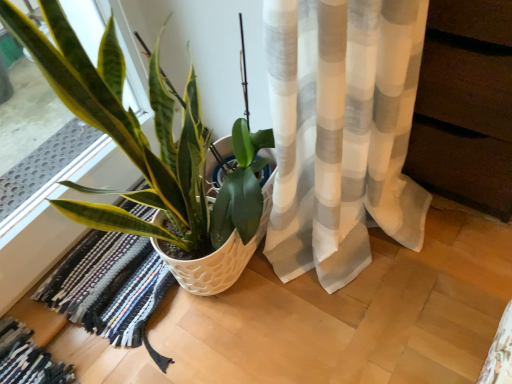
What is the approximate height of white textured pot at lower left?

29.17 inches.

At what (x,y) coordinates should I click in order to perform the action: click on white textured pot at lower left. Please return your answer as a coordinate pair (x, y). Looking at the image, I should click on tap(153, 154).

The image size is (512, 384). What do you see at coordinates (153, 154) in the screenshot?
I see `white textured pot at lower left` at bounding box center [153, 154].

Describe the element at coordinates (110, 288) in the screenshot. I see `rug with frayed edges at lower left` at that location.

Where is `rug with frayed edges at lower left`? rug with frayed edges at lower left is located at coordinates (110, 288).

Find the location of `white textured pot at lower left`. white textured pot at lower left is located at coordinates (153, 154).

Would you say rug with frayed edges at lower left is to the left or to the right of white textured pot at lower left in the picture?

Clearly, rug with frayed edges at lower left is on the left of white textured pot at lower left in the image.

Is rug with frayed edges at lower left further to camera compared to white textured pot at lower left?

Yes, rug with frayed edges at lower left is further from the viewer.

Is point (131, 242) less distant than point (245, 82)?

That is False.

From the image's perspective, which one is positioned higher, rug with frayed edges at lower left or white textured pot at lower left?

white textured pot at lower left appears higher in the image.

From a real-world perspective, which is physically above, rug with frayed edges at lower left or white textured pot at lower left?

white textured pot at lower left, from a real-world perspective.

From the picture: Which of these two, rug with frayed edges at lower left or white textured pot at lower left, is wider?

rug with frayed edges at lower left.

Considering the relative sizes of rug with frayed edges at lower left and white textured pot at lower left in the image provided, is rug with frayed edges at lower left shorter than white textured pot at lower left?

Yes.

Between rug with frayed edges at lower left and white textured pot at lower left, which one has smaller size?

rug with frayed edges at lower left.

Is white textured pot at lower left a part of rug with frayed edges at lower left?

Definitely not — white textured pot at lower left is not inside rug with frayed edges at lower left.

Is rug with frayed edges at lower left touching white textured pot at lower left?

No.

Does rug with frayed edges at lower left turn towards white textured pot at lower left?

Yes, rug with frayed edges at lower left is facing white textured pot at lower left.

How many degrees apart are the facing directions of rug with frayed edges at lower left and white textured pot at lower left?

The facing directions of rug with frayed edges at lower left and white textured pot at lower left are 1.31 degrees apart.

At what (x,y) coordinates should I click in order to perform the action: click on mat directly beneath the white textured pot at lower left (from a real-world perspective). Please return your answer as a coordinate pair (x, y). Looking at the image, I should click on (110, 288).

Considering the positions of objects white textured pot at lower left and rug with frayed edges at lower left in the image provided, who is more to the right, white textured pot at lower left or rug with frayed edges at lower left?

white textured pot at lower left.

Which object is further away from the camera, white textured pot at lower left or rug with frayed edges at lower left?

rug with frayed edges at lower left is further away from the camera.

Which is more distant, (78, 201) or (94, 284)?

The point (94, 284) is more distant.

From the image's perspective, would you say white textured pot at lower left is positioned over rug with frayed edges at lower left?

Indeed, from the image's perspective, white textured pot at lower left is shown above rug with frayed edges at lower left.

From a real-world perspective, which object rests below the other?

rug with frayed edges at lower left is physically lower.

Between white textured pot at lower left and rug with frayed edges at lower left, which one has larger width?

Wider between the two is rug with frayed edges at lower left.

Does white textured pot at lower left have a lesser height compared to rug with frayed edges at lower left?

No.

Between white textured pot at lower left and rug with frayed edges at lower left, which one has larger size?

white textured pot at lower left is bigger.

Is white textured pot at lower left situated inside rug with frayed edges at lower left or outside?

white textured pot at lower left is outside rug with frayed edges at lower left.

Is white textured pot at lower left next to rug with frayed edges at lower left and touching it?

white textured pot at lower left is not next to rug with frayed edges at lower left, and they're not touching.

Is rug with frayed edges at lower left at the back of white textured pot at lower left?

Absolutely, white textured pot at lower left is directed away from rug with frayed edges at lower left.

What's the angular difference between white textured pot at lower left and rug with frayed edges at lower left's facing directions?

The angle between the facing direction of white textured pot at lower left and the facing direction of rug with frayed edges at lower left is 1.31 degrees.

There is a rug with frayed edges at lower left. Find the location of `houseplant above it (from a real-world perspective)`. houseplant above it (from a real-world perspective) is located at coordinates (153, 154).

Locate an element on the screen. This screenshot has height=384, width=512. houseplant in front of the rug with frayed edges at lower left is located at coordinates (153, 154).

The width and height of the screenshot is (512, 384). I want to click on houseplant that appears on the right of rug with frayed edges at lower left, so click(153, 154).